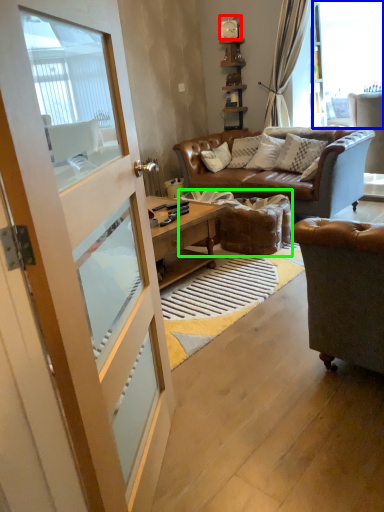
Question: Which is farther away from clock (highlighted by a red box)? window (highlighted by a blue box) or footrest (highlighted by a green box)?

Choices:
 (A) window
 (B) footrest

Answer: (B)